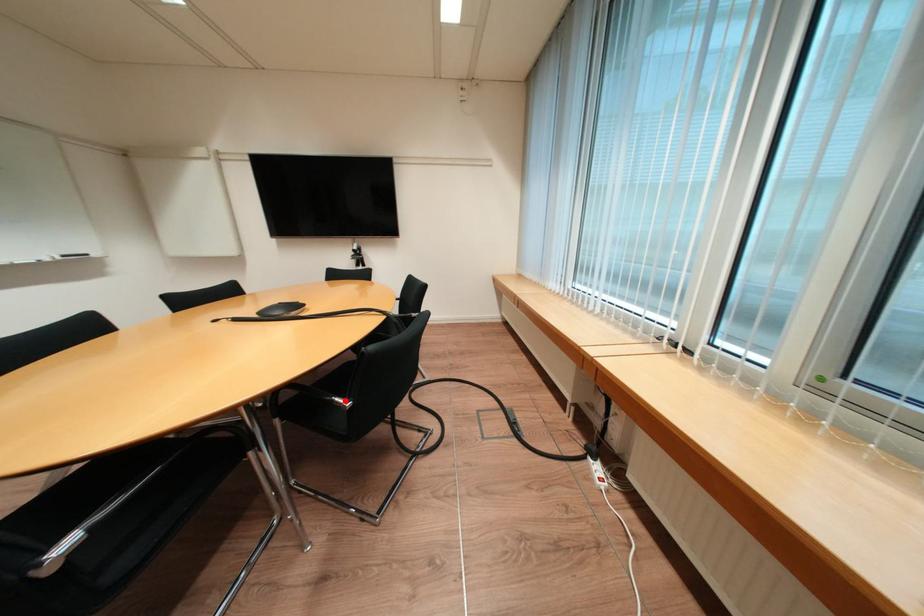
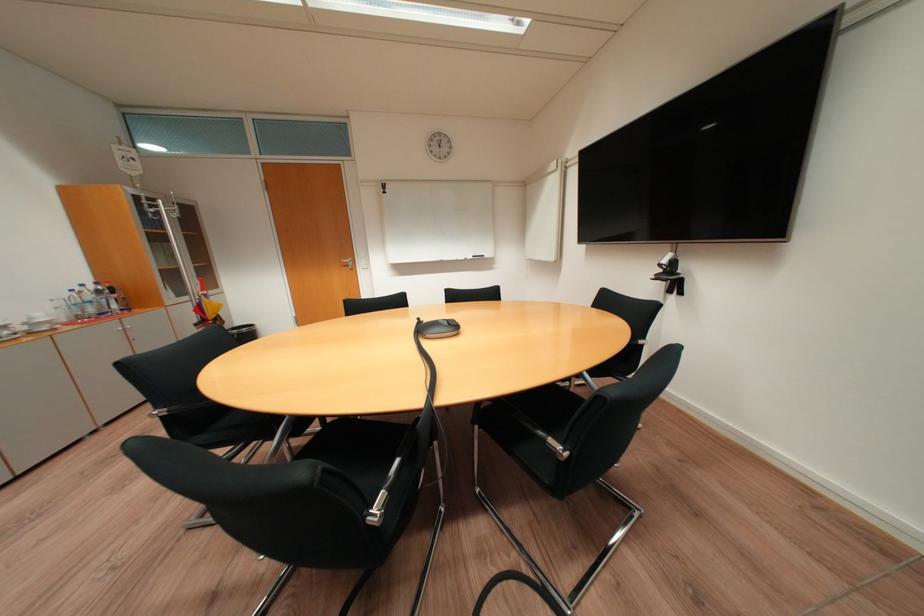
Question: I am providing you with two images of the same scene from different viewpoints. A red point is marked on the first image. At the location where the point appears in image 1, is it still visible in image 2?

Choices:
 (A) Yes
 (B) No

Answer: (B)